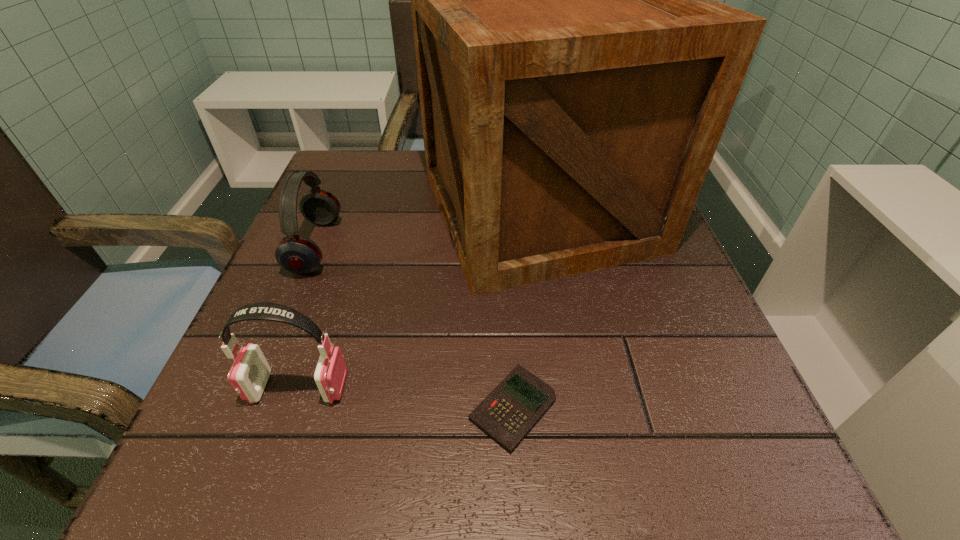
I want to click on object present at the right edge, so click(x=576, y=74).

You are a GUI agent. You are given a task and a screenshot of the screen. Output one action in this format:
    pyautogui.click(x=<x>, y=<y>)
    Task: Click on the object that is at the far right corner
    
    Given the screenshot: What is the action you would take?
    pyautogui.click(x=576, y=74)

The height and width of the screenshot is (540, 960). Find the location of `vacant space at the far edge`. vacant space at the far edge is located at coordinates (390, 193).

Locate an element on the screen. The height and width of the screenshot is (540, 960). vacant region at the near edge is located at coordinates (498, 470).

Locate an element on the screen. This screenshot has height=540, width=960. free space at the left edge of the desktop is located at coordinates (286, 368).

Where is `free space at the right edge of the desktop`? free space at the right edge of the desktop is located at coordinates (663, 353).

Locate an element on the screen. The width and height of the screenshot is (960, 540). vacant space at the near right corner is located at coordinates (754, 466).

Locate an element on the screen. This screenshot has height=540, width=960. free space between the box and the calculator is located at coordinates (525, 309).

Image resolution: width=960 pixels, height=540 pixels. I want to click on vacant space in between the nearer earphone and the farther earphone, so click(x=307, y=317).

Locate an element on the screen. Image resolution: width=960 pixels, height=540 pixels. free area in between the shortest object and the tallest object is located at coordinates (525, 309).